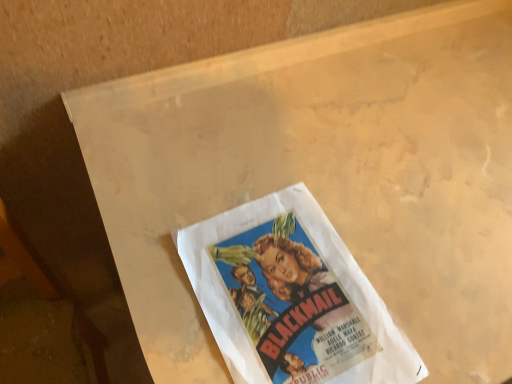
Identify the location of vacant space underneath matte paper poster at center (from a real-world perspective). pyautogui.click(x=286, y=296).